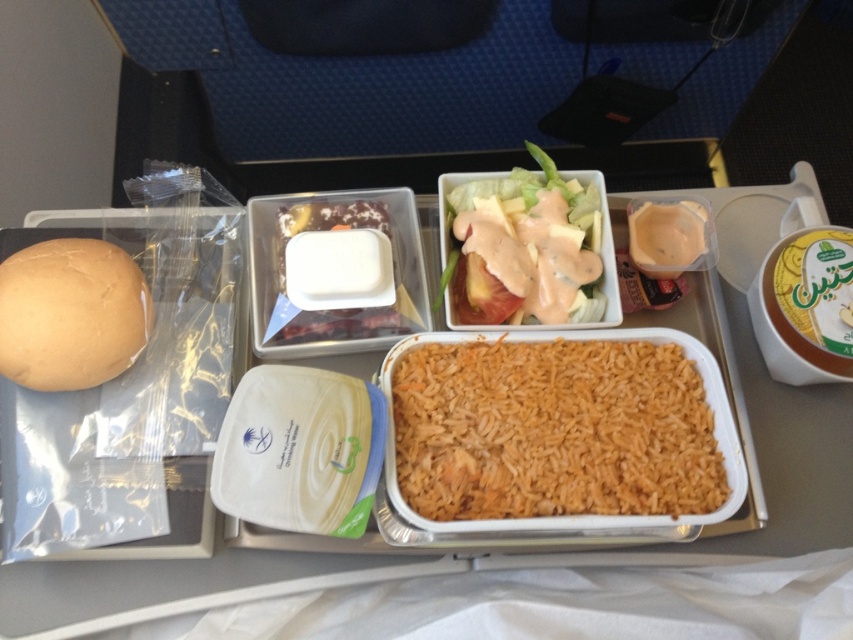
Consider the image. Can you confirm if golden matte bun at left is shorter than matte plastic sauce at upper right?

No.

Between golden matte bun at left and matte plastic sauce at upper right, which one appears on the left side from the viewer's perspective?

golden matte bun at left is more to the left.

Which is behind, point (9, 371) or point (674, 262)?

Point (674, 262)

What are the coordinates of `golden matte bun at left` in the screenshot? It's located at (70, 314).

From the picture: Does brown matte rice at center have a greater height compared to golden matte bun at left?

Indeed, brown matte rice at center has a greater height compared to golden matte bun at left.

Where is `brown matte rice at center`? The image size is (853, 640). brown matte rice at center is located at coordinates (769, 376).

At what (x,y) coordinates should I click in order to perform the action: click on brown matte rice at center. Please return your answer as a coordinate pair (x, y). Looking at the image, I should click on (769, 376).

Measure the distance between brown matte rice at center and camera.

brown matte rice at center and camera are 30.90 inches apart.

Between brown matte rice at center and matte plastic sauce at upper right, which one has less height?

With less height is matte plastic sauce at upper right.

Which is behind, point (776, 525) or point (631, 260)?

The point (631, 260) is behind.

Locate an element on the screen. Image resolution: width=853 pixels, height=640 pixels. brown matte rice at center is located at coordinates (769, 376).